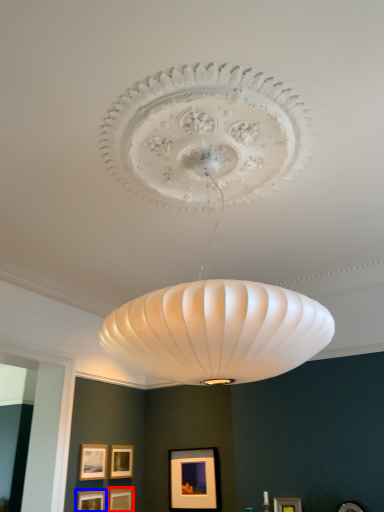
Question: Among these objects, which one is nearest to the camera, picture frame (highlighted by a red box) or picture frame (highlighted by a blue box)?

Choices:
 (A) picture frame
 (B) picture frame

Answer: (B)